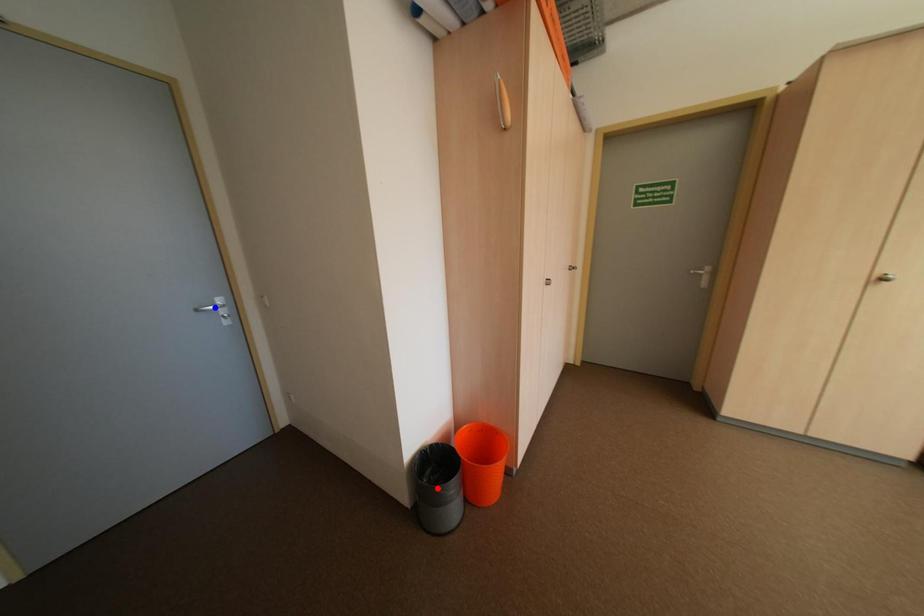
Question: Two points are marked on the image. Which point is closer to the camera?

Choices:
 (A) Blue point is closer.
 (B) Red point is closer.

Answer: (B)